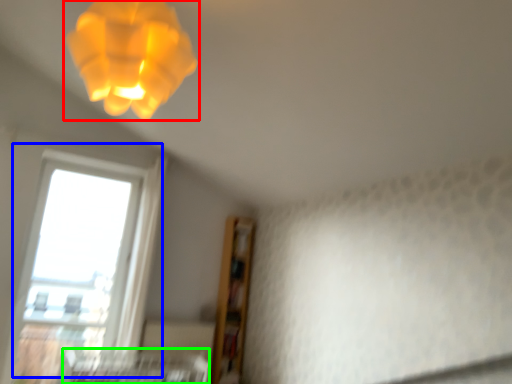
Question: Which object is positioned closest to lamp (highlighted by a red box)? Select from window (highlighted by a blue box) and bed frame (highlighted by a green box).

Choices:
 (A) window
 (B) bed frame

Answer: (A)